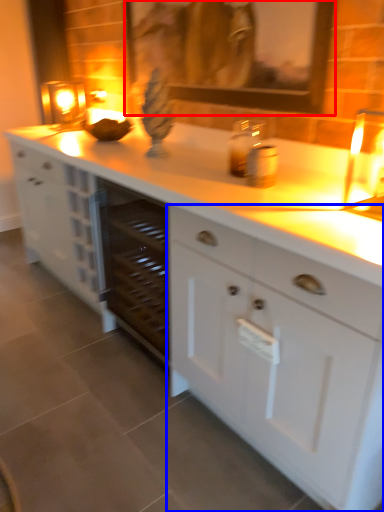
Question: Which point is further to the camera, picture frame (highlighted by a red box) or cabinetry (highlighted by a blue box)?

Choices:
 (A) picture frame
 (B) cabinetry

Answer: (A)